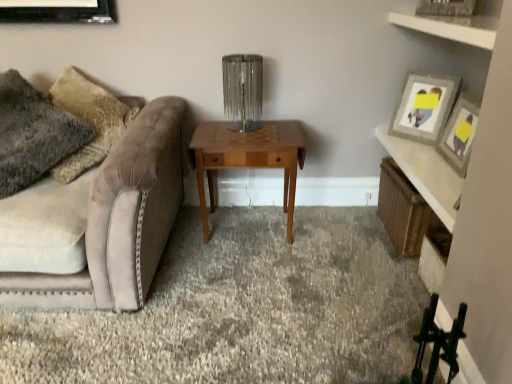
Where is `free location above clear glass table lamp at center (from a real-world perspective)`? free location above clear glass table lamp at center (from a real-world perspective) is located at coordinates 240,58.